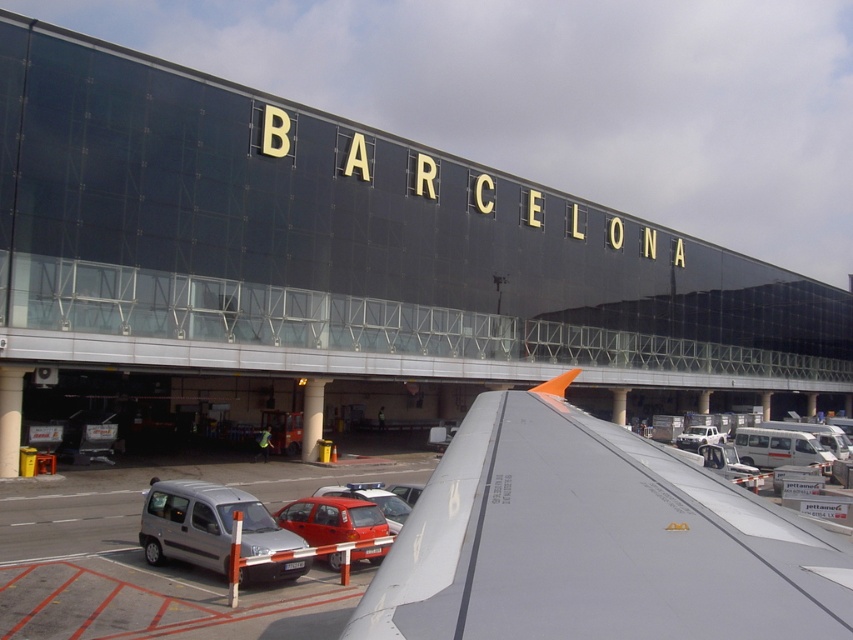
Is black glass airport terminal at center thinner than yellow painted concrete pillar at center?

Incorrect, black glass airport terminal at center's width is not less than yellow painted concrete pillar at center's.

Is point (773, 321) positioned before point (3, 396)?

No, it is not.

Does point (61, 198) come farther from viewer compared to point (18, 448)?

That is True.

Locate an element on the screen. black glass airport terminal at center is located at coordinates (345, 266).

How much distance is there between matte red hatchback at center and gray concrete pillar at center?

matte red hatchback at center and gray concrete pillar at center are 40.62 meters apart.

Can you confirm if matte red hatchback at center is taller than gray concrete pillar at center?

Incorrect, matte red hatchback at center's height is not larger of gray concrete pillar at center's.

Identify the location of matte red hatchback at center. Image resolution: width=853 pixels, height=640 pixels. (331, 518).

Find the location of a particular element. The image size is (853, 640). matte red hatchback at center is located at coordinates (331, 518).

Which is above, yellow painted concrete pillar at center or gray concrete pillar at center?

yellow painted concrete pillar at center

This screenshot has height=640, width=853. In order to click on yellow painted concrete pillar at center in this screenshot , I will do `click(10, 419)`.